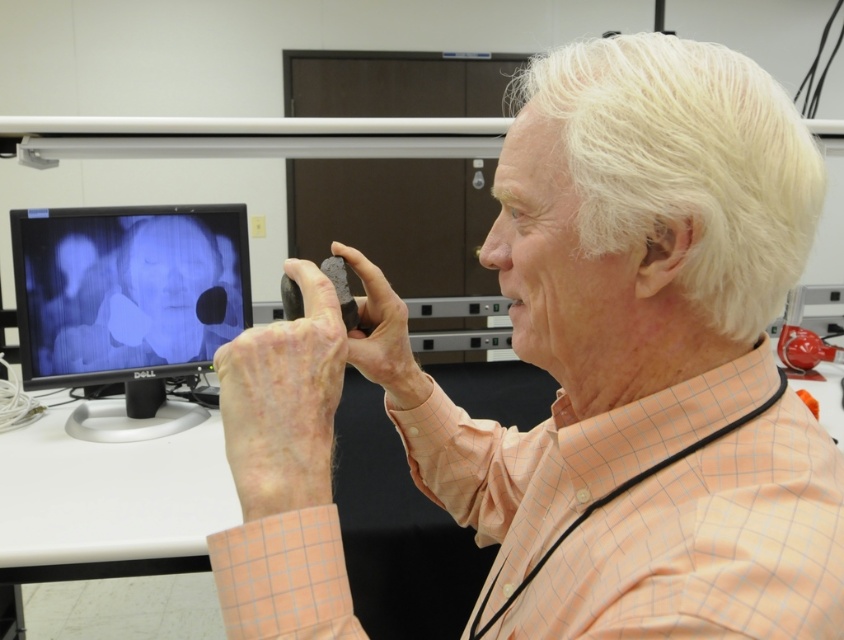
Based on the photo, which is more to the left, matte black rock at center or matte black monitor at left?

Positioned to the left is matte black monitor at left.

Is point (648, 72) more distant than point (85, 346)?

No, (648, 72) is in front of (85, 346).

Is point (528, 452) closer to viewer compared to point (134, 349)?

Yes, point (528, 452) is closer to viewer.

At what (x,y) coordinates should I click in order to perform the action: click on matte black rock at center. Please return your answer as a coordinate pair (x, y). Looking at the image, I should click on (580, 378).